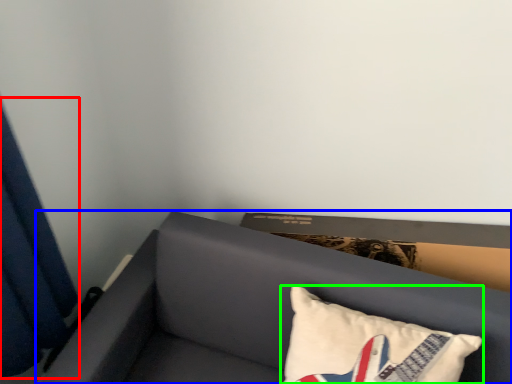
Question: Which is nearer to the curtain (highlighted by a red box)? furniture (highlighted by a blue box) or pillow (highlighted by a green box).

Choices:
 (A) furniture
 (B) pillow

Answer: (A)